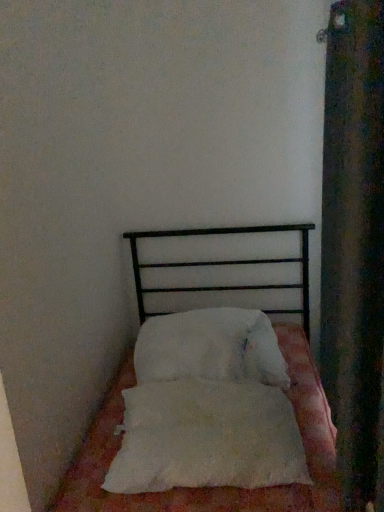
Question: Considering the positions of white soft bed at center and white fluffy pillow at center, which is counted as the first pillow, starting from the front, in the image, is white soft bed at center bigger or smaller than white fluffy pillow at center, which is counted as the first pillow, starting from the front,?

Choices:
 (A) small
 (B) big

Answer: (B)

Question: Is white soft bed at center spatially inside white fluffy pillow at center, positioned as the second pillow in back-to-front order, or outside of it?

Choices:
 (A) outside
 (B) inside

Answer: (A)

Question: Which of these objects is positioned closest to the white fluffy pillow at center, which ranks as the first pillow in back-to-front order?

Choices:
 (A) white fluffy pillow at center, which is counted as the first pillow, starting from the front
 (B) velvet dark green curtain at right
 (C) white soft bed at center

Answer: (A)

Question: Which object is positioned closest to the white fluffy pillow at center, positioned as the second pillow in back-to-front order?

Choices:
 (A) velvet dark green curtain at right
 (B) white fluffy pillow at center, arranged as the second pillow when viewed from the front
 (C) white soft bed at center

Answer: (C)